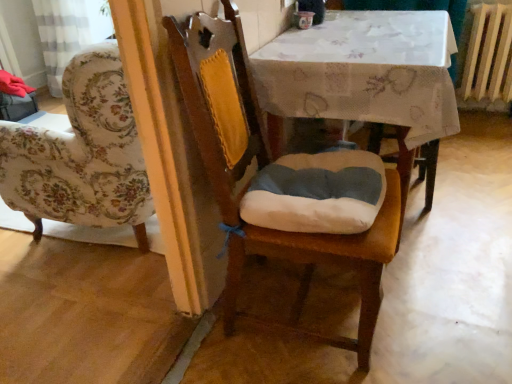
Question: Would you say wooden chair at center is outside wooden radiator at right?

Choices:
 (A) no
 (B) yes

Answer: (B)

Question: Does wooden chair at center come behind wooden radiator at right?

Choices:
 (A) no
 (B) yes

Answer: (A)

Question: Considering the relative positions of wooden chair at center and wooden radiator at right in the image provided, is wooden chair at center to the right of wooden radiator at right from the viewer's perspective?

Choices:
 (A) yes
 (B) no

Answer: (B)

Question: Is wooden chair at center next to wooden radiator at right?

Choices:
 (A) yes
 (B) no

Answer: (B)

Question: Is wooden chair at center bigger than wooden radiator at right?

Choices:
 (A) yes
 (B) no

Answer: (A)

Question: Can you confirm if wooden chair at center is smaller than wooden radiator at right?

Choices:
 (A) yes
 (B) no

Answer: (B)

Question: From the image's perspective, would you say wooden radiator at right is shown under wooden chair at center?

Choices:
 (A) yes
 (B) no

Answer: (B)

Question: Considering the relative positions of wooden radiator at right and wooden chair at center in the image provided, is wooden radiator at right to the left of wooden chair at center from the viewer's perspective?

Choices:
 (A) no
 (B) yes

Answer: (A)

Question: Would you say wooden radiator at right is outside wooden chair at center?

Choices:
 (A) no
 (B) yes

Answer: (B)

Question: Does wooden radiator at right have a greater width compared to wooden chair at center?

Choices:
 (A) yes
 (B) no

Answer: (B)

Question: From the image's perspective, is wooden radiator at right on wooden chair at center?

Choices:
 (A) no
 (B) yes

Answer: (B)

Question: Could wooden chair at center be considered to be inside wooden radiator at right?

Choices:
 (A) yes
 (B) no

Answer: (B)

Question: From a real-world perspective, is wooden radiator at right physically below white fabric table at center?

Choices:
 (A) no
 (B) yes

Answer: (A)